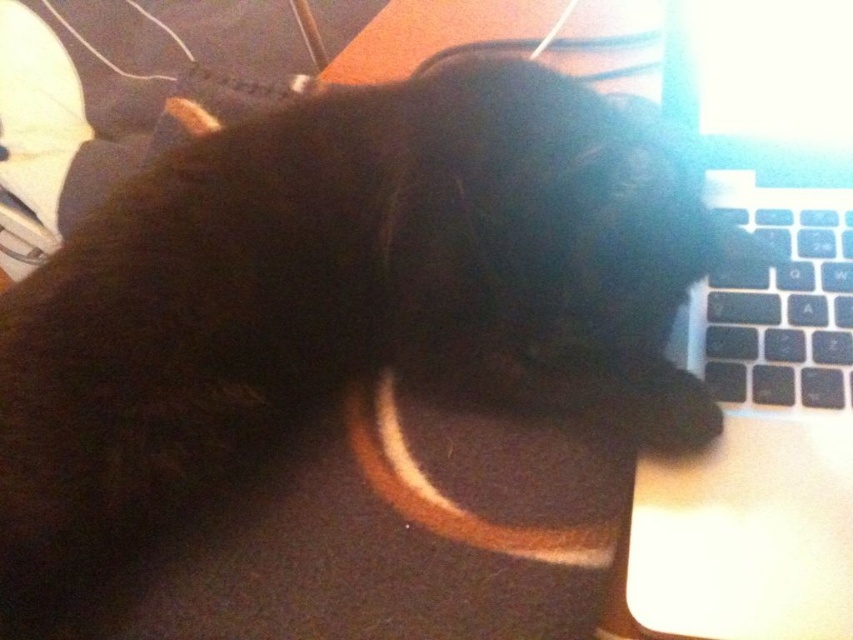
Question: Is sleek black laptop at right to the left of black matte keyboard at right from the viewer's perspective?

Choices:
 (A) no
 (B) yes

Answer: (B)

Question: Which object appears closest to the camera in this image?

Choices:
 (A) black fur paw at lower center
 (B) sleek black laptop at right
 (C) black matte keyboard at right

Answer: (B)

Question: Can you confirm if black matte keyboard at right is positioned below black fur paw at lower center?

Choices:
 (A) no
 (B) yes

Answer: (A)

Question: Which object appears closest to the camera in this image?

Choices:
 (A) black fur paw at lower center
 (B) sleek black laptop at right

Answer: (B)

Question: Does sleek black laptop at right appear over black matte keyboard at right?

Choices:
 (A) yes
 (B) no

Answer: (B)

Question: Which point is farther to the camera?

Choices:
 (A) black fur paw at lower center
 (B) black matte keyboard at right

Answer: (B)